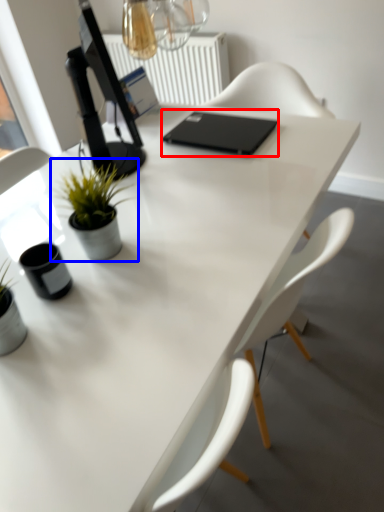
Question: Which point is further to the camera, laptop (highlighted by a red box) or houseplant (highlighted by a blue box)?

Choices:
 (A) laptop
 (B) houseplant

Answer: (A)